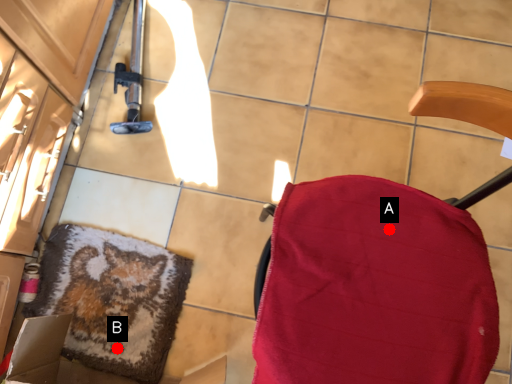
Question: Two points are circled on the image, labeled by A and B beside each circle. Among these points, which one is farthest from the camera?

Choices:
 (A) A is further
 (B) B is further

Answer: (B)